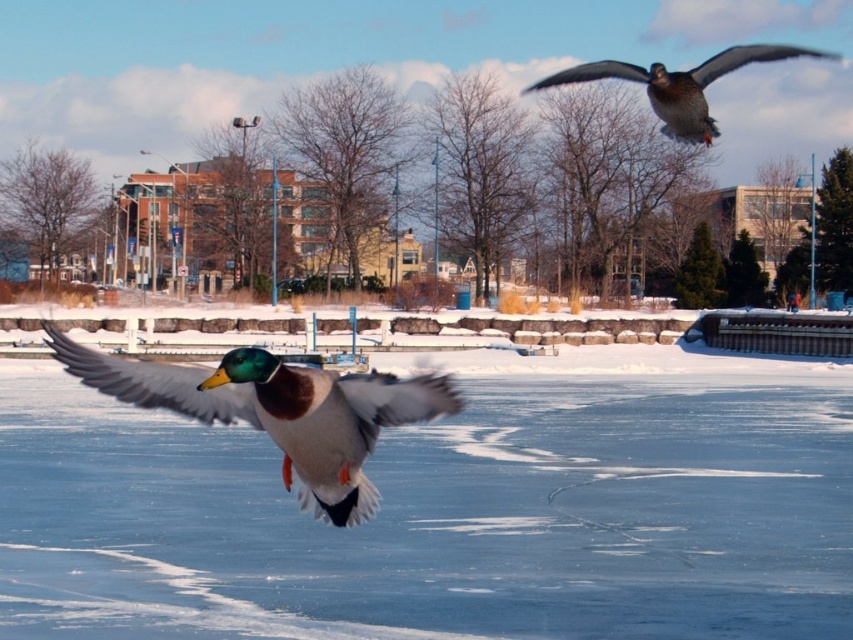
Question: Is translucent ice at center smaller than shiny brown duck at center?

Choices:
 (A) yes
 (B) no

Answer: (B)

Question: Which is nearer to the shiny brown duck at center?

Choices:
 (A) translucent ice at center
 (B) shiny brown duck at upper right

Answer: (A)

Question: Where is translucent ice at center located in relation to shiny brown duck at center in the image?

Choices:
 (A) right
 (B) left

Answer: (B)

Question: Which object is the closest to the shiny brown duck at upper right?

Choices:
 (A) shiny brown duck at center
 (B) translucent ice at center

Answer: (B)

Question: Based on their relative distances, which object is farther from the translucent ice at center?

Choices:
 (A) shiny brown duck at upper right
 (B) shiny brown duck at center

Answer: (B)

Question: Considering the relative positions of translucent ice at center and shiny brown duck at center in the image provided, where is translucent ice at center located with respect to shiny brown duck at center?

Choices:
 (A) below
 (B) above

Answer: (A)